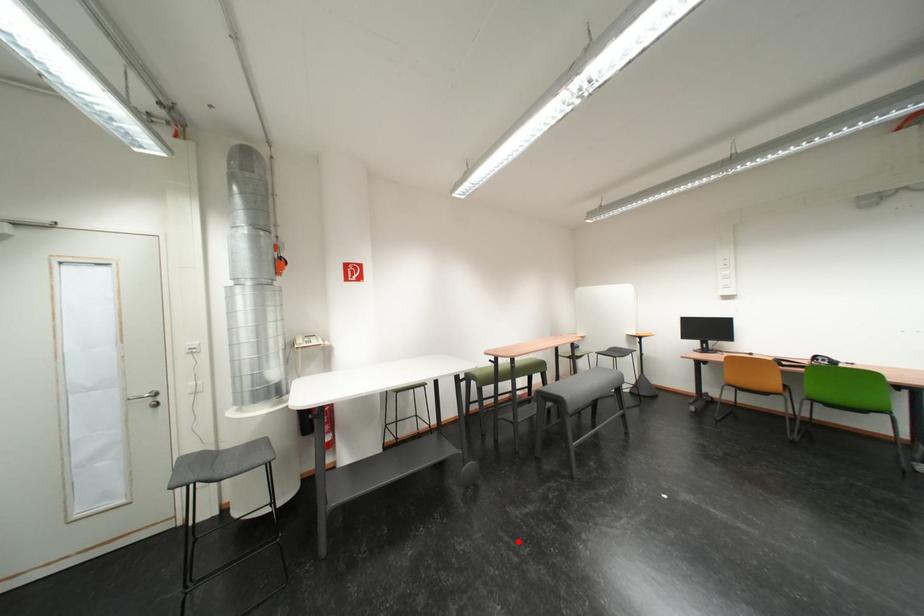
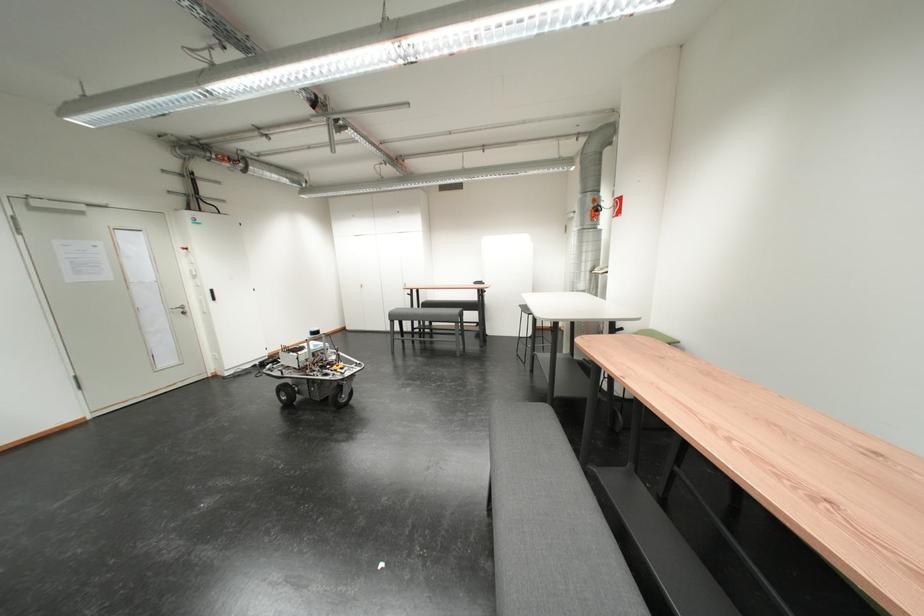
Where in the second image is the point corresponding to the highlighted location from the first image?

(494, 419)